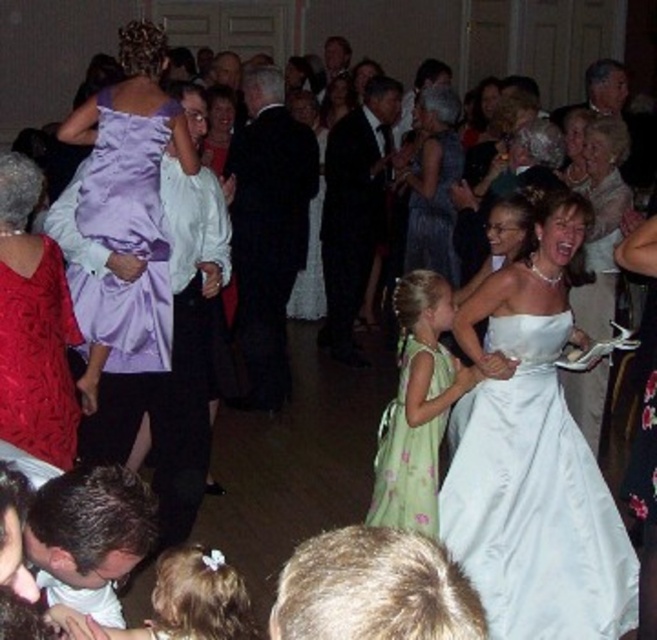
You are a photographer at the event and want to capture a photo that includes both the green floral dress at center and the white satin dress at right. Based on their positions, which dress should you focus on first to ensure both are in frame?

The green floral dress at center is below the white satin dress at right, so you should focus on the white satin dress at right first to ensure both are in frame.

You are a photographer at the event and need to adjust your camera focus. The dark suit at center and the purple satin dress at left are both in your frame. Which one should you focus on first if you want to capture the larger subject?

The dark suit at center is larger than the purple satin dress at left, so you should focus on the dark suit at center first to capture the larger subject.

You are at the coordinates 0.3, 0.4. You want to move to the dark suit at center. Which direction should you move in?

The dark suit at center is located at point (267, 228). Since you are at (261, 192), you should move slightly to the right and slightly forward to reach the dark suit at center.